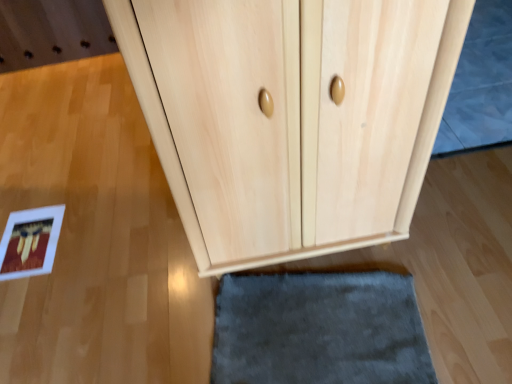
Question: Visually, is gray soft rug at upper right positioned to the left or to the right of natural wood cupboard at center?

Choices:
 (A) right
 (B) left

Answer: (A)

Question: From a real-world perspective, is gray soft rug at upper right physically located above or below natural wood cupboard at center?

Choices:
 (A) above
 (B) below

Answer: (B)

Question: Estimate the real-world distances between objects in this image. Which object is farther from the gray soft rug at upper right?

Choices:
 (A) natural wood cupboard at center
 (B) light wood door at center

Answer: (B)

Question: Estimate the real-world distances between objects in this image. Which object is closer to the gray soft rug at upper right?

Choices:
 (A) light wood door at center
 (B) natural wood cupboard at center

Answer: (B)